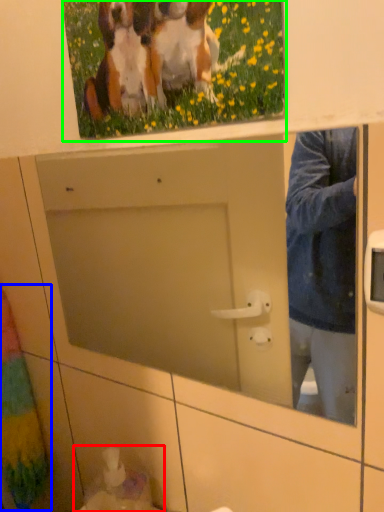
Question: Based on their relative distances, which object is farther from sink (highlighted by a red box)? Choose from curtain (highlighted by a blue box) and picture frame (highlighted by a green box).

Choices:
 (A) curtain
 (B) picture frame

Answer: (B)